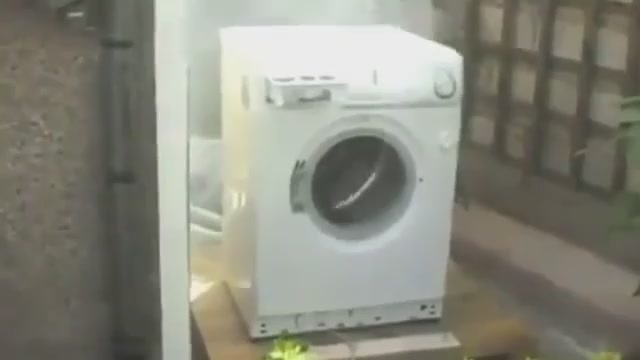
At what (x,y) coordinates should I click in order to perform the action: click on knob. Please return your answer as a coordinate pair (x, y). This screenshot has height=360, width=640. Looking at the image, I should click on (445, 86).